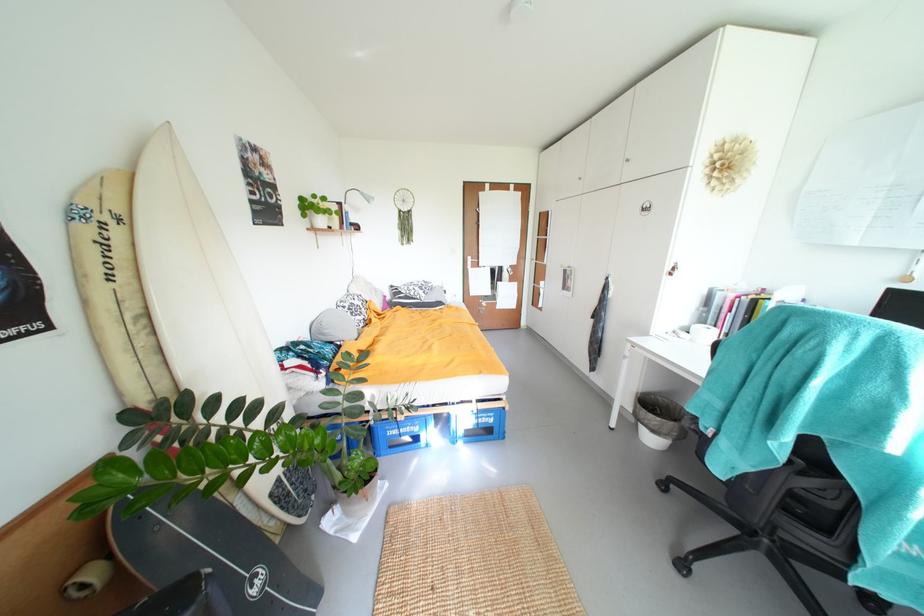
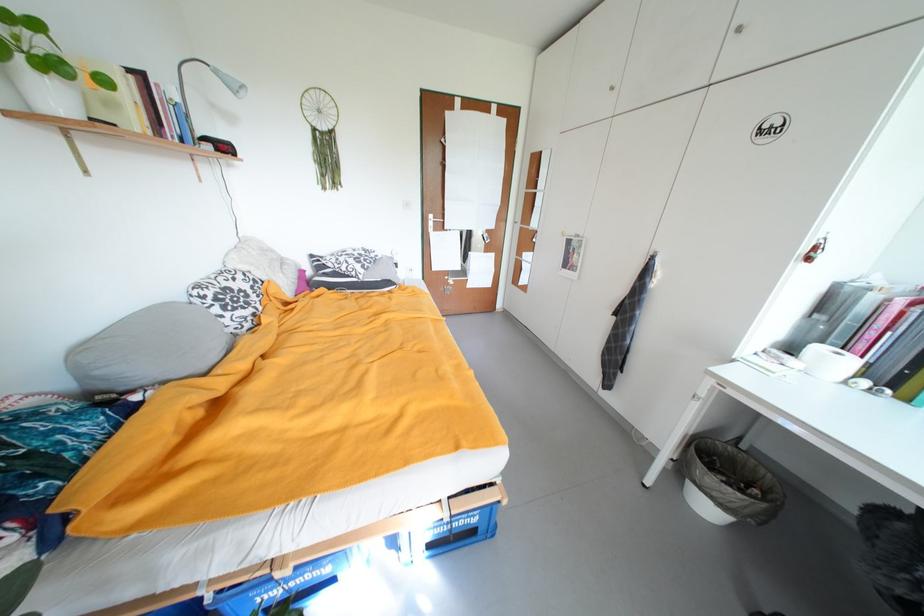
The point at (333,333) is marked in the first image. Where is the corresponding point in the second image?

(105, 374)